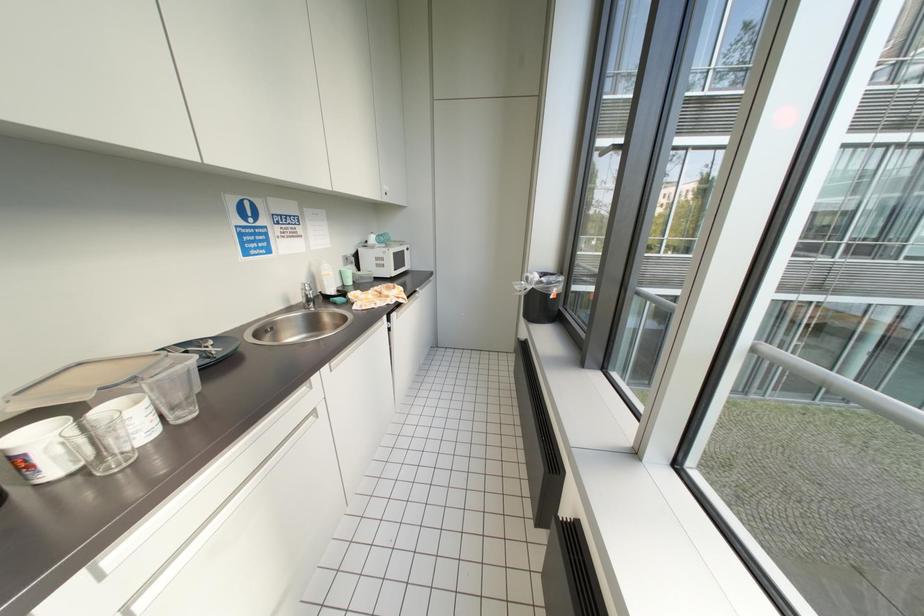
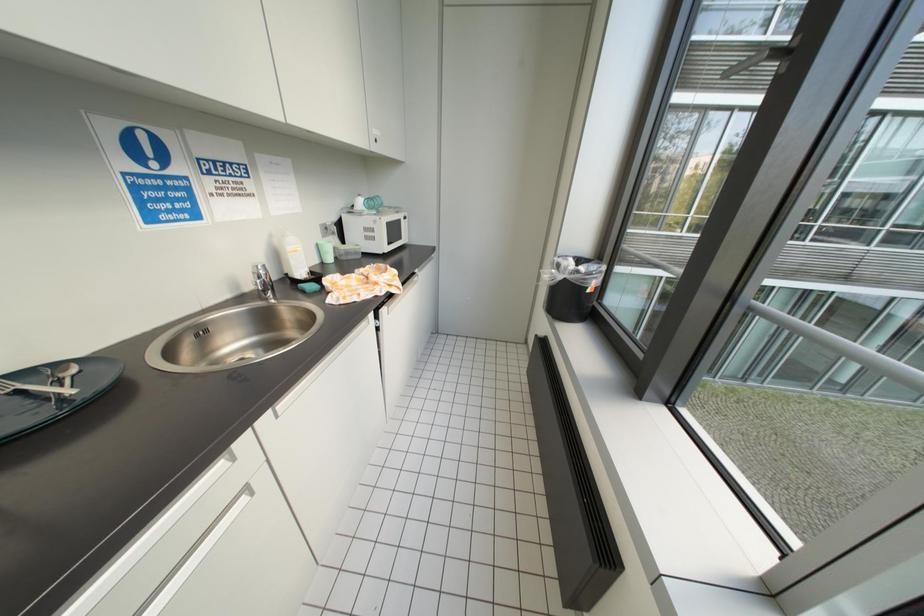
Question: The images are taken continuously from a first-person perspective. In which direction is your viewpoint rotating?

Choices:
 (A) Left
 (B) Right
 (C) Up
 (D) Down

Answer: (D)